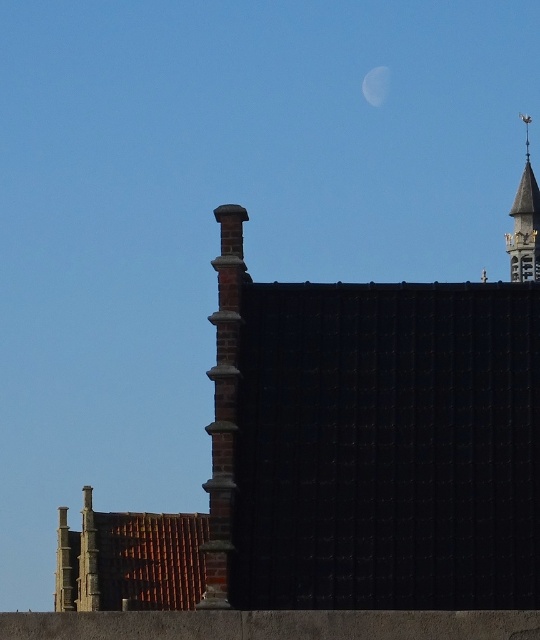
You are an astronomer observing the night sky. You notice a celestial object at point [524,221]. What is the name of the celestial object located at that coordinate?

The celestial object at point [524,221] is the crescent moon.

You are an architect reviewing a blueprint and notice two structures in the design. The blueprint shows the polished brass bell tower at upper right and the silver metallic moon at upper center. According to the blueprint, which structure is located to the right of the other?

The polished brass bell tower at upper right is positioned on the right side of the silver metallic moon at upper center, so the bell tower is to the right of the moon.

You are an architect designing a new observatory. The observatory must have a clear line of sight to both the polished brass bell tower at upper right and the silver metallic moon at upper center. Given the distance between them, what is the minimum width your observatory should have to ensure both are visible without obstruction?

The minimum width should be at least 131.81 feet to ensure both the polished brass bell tower at upper right and the silver metallic moon at upper center are visible without obstruction.